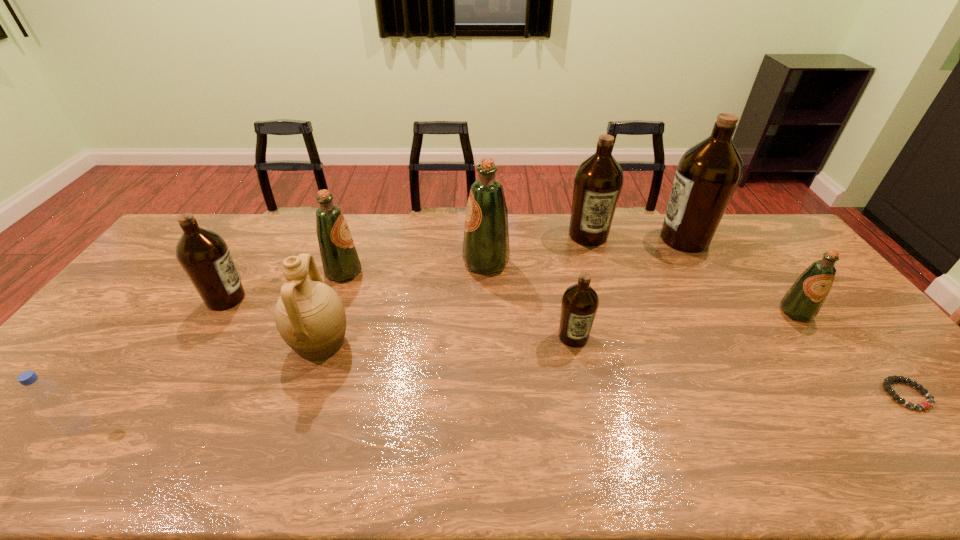
Locate an element on the screen. The image size is (960, 540). free space between the second object from right to left and the smallest brown olive oil is located at coordinates (684, 325).

Where is `vacant space that's between the third olive oil from left to right and the leftmost olive oil`? vacant space that's between the third olive oil from left to right and the leftmost olive oil is located at coordinates (356, 281).

The height and width of the screenshot is (540, 960). I want to click on free space between the third olive oil from left to right and the sixth olive oil from right to left, so click(x=415, y=267).

This screenshot has height=540, width=960. Identify the location of the seventh closest object to the leftmost object. (707, 175).

At what (x,y) coordinates should I click in order to perform the action: click on the fifth closest object to the second object from right to left. Please return your answer as a coordinate pair (x, y). The height and width of the screenshot is (540, 960). Looking at the image, I should click on (486, 250).

Point out which olive oil is positioned as the sixth nearest to the ninth farthest object. Please provide its 2D coordinates. Your answer should be formatted as a tuple, i.e. [(x, y)], where the tuple contains the x and y coordinates of a point satisfying the conditions above.

[(340, 261)]

Identify the location of olive oil object that ranks as the third closest to the leftmost green olive oil. The height and width of the screenshot is (540, 960). (580, 302).

Where is `brown olive oil that is the second closest to the leftmost olive oil`? brown olive oil that is the second closest to the leftmost olive oil is located at coordinates (598, 181).

The height and width of the screenshot is (540, 960). I want to click on brown olive oil that is the third closest to the pitcher, so click(598, 181).

The height and width of the screenshot is (540, 960). Identify the location of green olive oil object that ranks as the second closest to the second biggest green olive oil. (802, 302).